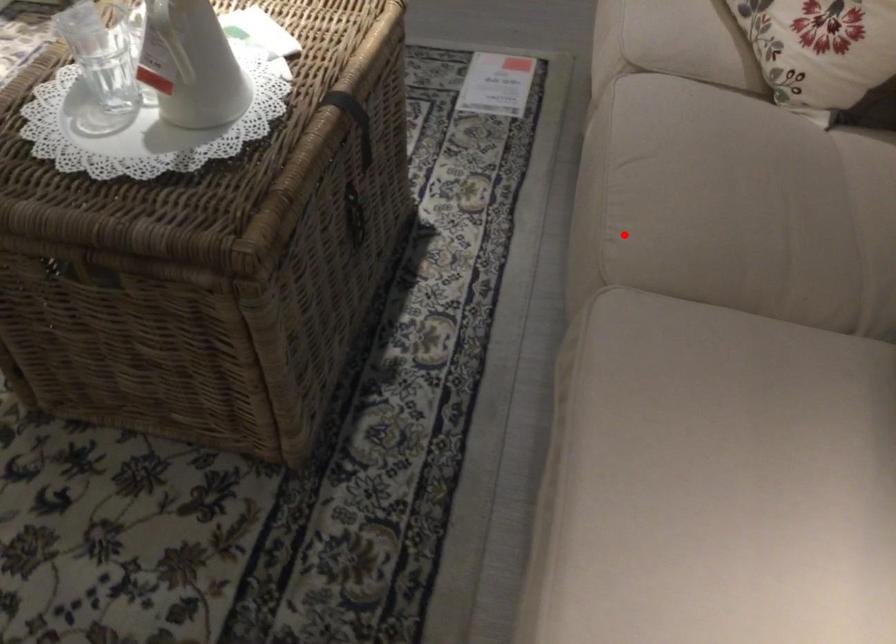
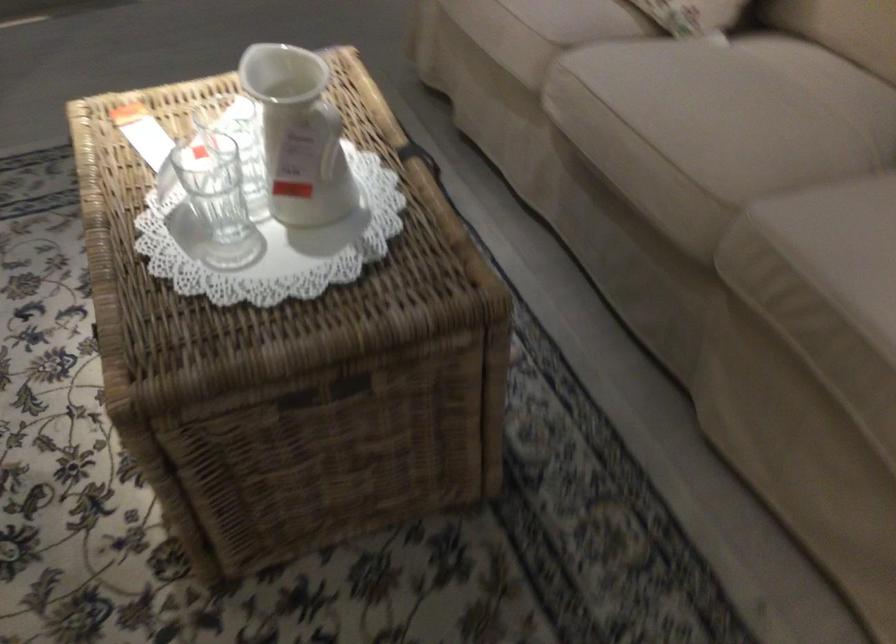
Question: I am providing you with two images of the same scene from different viewpoints. Image1 has a red point marked. In image2, the corresponding 3D location appears at what relative position? Reply with the corresponding letter.

Choices:
 (A) Closer
 (B) Farther

Answer: (B)